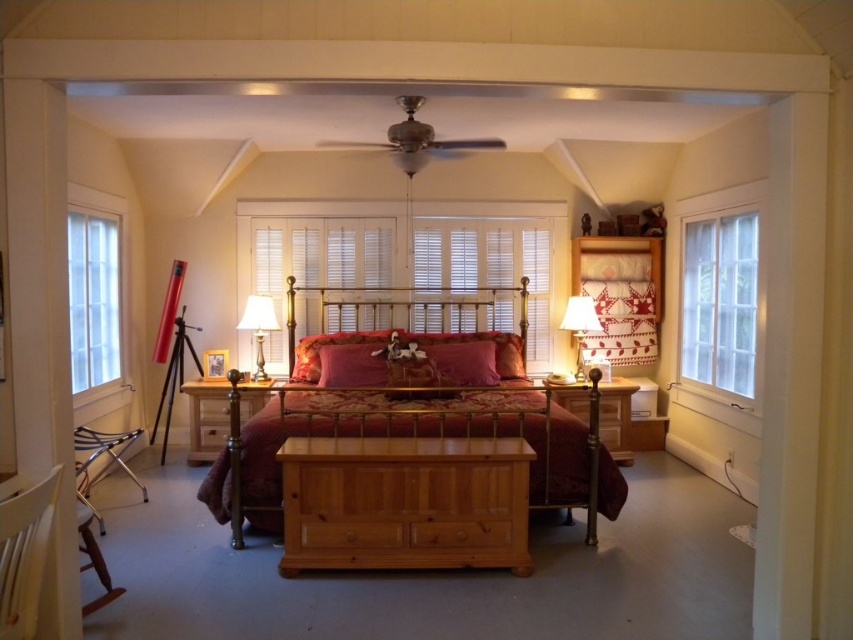
Question: Does clear glass window at right appear on the left side of matte red pillow at center?

Choices:
 (A) yes
 (B) no

Answer: (B)

Question: Which of the following is the farthest from the observer?

Choices:
 (A) clear glass window at right
 (B) matte red pillow at center
 (C) clear glass window at left
 (D) polished brass bed at center

Answer: (B)

Question: In this image, where is metallic gold headboard at center located relative to velvet red pillow at center?

Choices:
 (A) right
 (B) left

Answer: (A)

Question: Which of the following is the farthest from the observer?

Choices:
 (A) (262, 355)
 (B) (573, 330)
 (C) (364, 420)

Answer: (B)

Question: Among these objects, which one is nearest to the camera?

Choices:
 (A) matte gold lamp at left
 (B) matte red pillow at center
 (C) clear glass window at right
 (D) metallic gold headboard at center

Answer: (C)

Question: Can you confirm if polished brass bed at center is positioned below clear glass window at right?

Choices:
 (A) no
 (B) yes

Answer: (B)